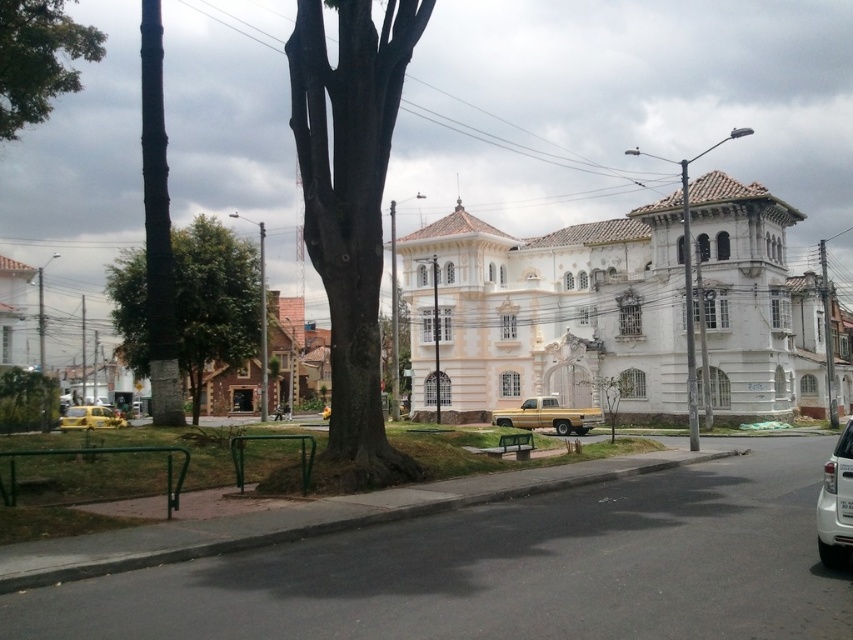
You are a painter setting up an easel to paint the brown rough bark tree at center and the white glossy building at upper center. Which object should you place closer to your easel to paint accurately, considering their sizes?

The brown rough bark tree at center has a larger size compared to the white glossy building at upper center, so you should place the easel closer to the brown rough bark tree at center to capture its details accurately.

You are a painter standing on the sidewalk in front of the brown rough bark tree at center and the white glossy building at upper center. You want to paint both the tree and the building. Which object should you focus on first if you want to capture the thinner structure first?

The brown rough bark tree at center is thinner than the white glossy building at upper center, so you should focus on painting the brown rough bark tree at center first.

You are standing at the center of the sidewalk in front of the white building with Spanish colonial architecture. You want to walk to the grassy area where the green leafy tree at lower left is located. Which direction should you walk?

You should walk towards the lower left direction to reach the green leafy tree at lower left located at point (27,401).